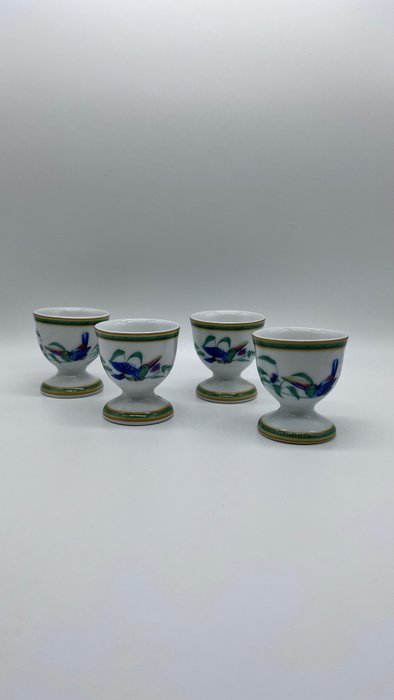
The height and width of the screenshot is (700, 394). Find the location of `cup`. cup is located at coordinates (144, 385), (218, 382), (306, 367), (71, 341).